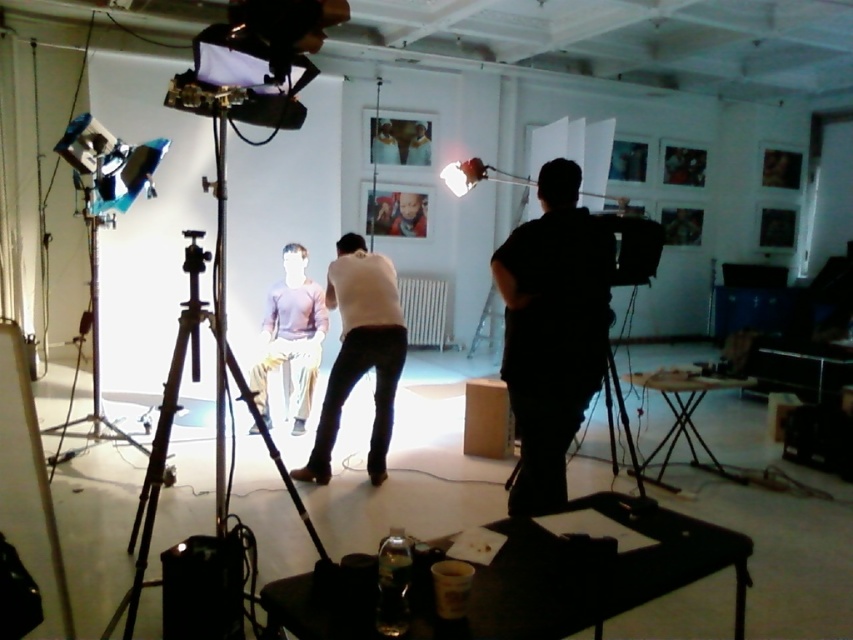
From the picture: You are a photographer setting up a photoshoot in the studio. You have two shirts to choose from for the model. The black matte shirt at right and the matte purple shirt at center. Which shirt is taller?

The black matte shirt at right is taller than the matte purple shirt at center.

You are a camera operator in the studio. You need to adjust the focus ring to ensure both the point at [163,410] and the point at [415,234] are in focus. Since the points are at different distances from you, which point should you focus on first to achieve clear focus for both?

Since point [163,410] is closer to the viewer than point [415,234], you should focus on the closer point first. This ensures the depth of field can cover both points effectively.

You are setting up a camera in the studio and need to ensure there is enough space between the black matte shirt at right and the black matte tripod at center for a cable to pass through. Since cables need at least 20 cm of space, can the cable fit between them based on their widths?

The black matte shirt at right has a lesser width compared to the black matte tripod at center. However, the description only provides information about their widths relative to each other, not the actual distance between them. Without knowing the exact spacing between the two objects, it is impossible to determine if the 20 cm requirement is met.